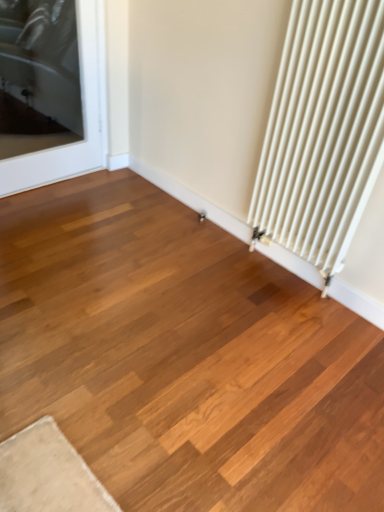
This screenshot has width=384, height=512. What do you see at coordinates (83, 118) in the screenshot? I see `transparent glass door at upper left` at bounding box center [83, 118].

Identify the location of transparent glass door at upper left. (83, 118).

What is the approximate height of transparent glass door at upper left?

38.09 inches.

The height and width of the screenshot is (512, 384). I want to click on white matte radiator at right, so click(322, 128).

What do you see at coordinates (322, 128) in the screenshot?
I see `white matte radiator at right` at bounding box center [322, 128].

Where is `transparent glass door at upper left`? This screenshot has width=384, height=512. transparent glass door at upper left is located at coordinates (83, 118).

Is transparent glass door at upper left to the left or to the right of white matte radiator at right in the image?

transparent glass door at upper left is to the left of white matte radiator at right.

Does transparent glass door at upper left come in front of white matte radiator at right?

No, the depth of transparent glass door at upper left is greater than that of white matte radiator at right.

Does point (83, 5) lie in front of point (255, 189)?

That is False.

From the image's perspective, is transparent glass door at upper left above or below white matte radiator at right?

transparent glass door at upper left is above white matte radiator at right.

From a real-world perspective, is transparent glass door at upper left positioned over white matte radiator at right based on gravity?

No, from a real-world perspective, transparent glass door at upper left is not over white matte radiator at right

Considering the sizes of objects transparent glass door at upper left and white matte radiator at right in the image provided, who is thinner, transparent glass door at upper left or white matte radiator at right?

transparent glass door at upper left is thinner.

In terms of height, does transparent glass door at upper left look taller or shorter compared to white matte radiator at right?

In the image, transparent glass door at upper left appears to be shorter than white matte radiator at right.

Which of these two, transparent glass door at upper left or white matte radiator at right, is bigger?

white matte radiator at right is bigger.

Does transparent glass door at upper left contain white matte radiator at right?

No, white matte radiator at right is not inside transparent glass door at upper left.

Is transparent glass door at upper left positioned far away from white matte radiator at right?

Yes, transparent glass door at upper left is far from white matte radiator at right.

Is transparent glass door at upper left oriented towards white matte radiator at right?

Yes, transparent glass door at upper left is facing white matte radiator at right.

The image size is (384, 512). I want to click on radiator below the transparent glass door at upper left (from the image's perspective), so click(x=322, y=128).

Is white matte radiator at right at the left side of transparent glass door at upper left?

No, white matte radiator at right is not to the left of transparent glass door at upper left.

Is the depth of white matte radiator at right greater than that of transparent glass door at upper left?

No.

Considering the positions of points (363, 42) and (82, 85), is point (363, 42) closer to camera compared to point (82, 85)?

Yes, it is.

From the image's perspective, is white matte radiator at right above or below transparent glass door at upper left?

From the image's perspective, white matte radiator at right appears below transparent glass door at upper left.

From a real-world perspective, is white matte radiator at right located higher than transparent glass door at upper left?

Yes.

Is white matte radiator at right wider or thinner than transparent glass door at upper left?

Clearly, white matte radiator at right has more width compared to transparent glass door at upper left.

Considering the sizes of white matte radiator at right and transparent glass door at upper left in the image, is white matte radiator at right taller or shorter than transparent glass door at upper left?

In the image, white matte radiator at right appears to be taller than transparent glass door at upper left.

Looking at this image, does white matte radiator at right have a smaller size compared to transparent glass door at upper left?

Actually, white matte radiator at right might be larger than transparent glass door at upper left.

Is white matte radiator at right completely or partially outside of transparent glass door at upper left?

Yes, white matte radiator at right is outside of transparent glass door at upper left.

Would you consider white matte radiator at right to be distant from transparent glass door at upper left?

Yes.

Is white matte radiator at right oriented towards transparent glass door at upper left?

No, white matte radiator at right is not turned towards transparent glass door at upper left.

What's the angular difference between white matte radiator at right and transparent glass door at upper left's facing directions?

They differ by 88.5 degrees in their facing directions.

How far apart are white matte radiator at right and transparent glass door at upper left?

white matte radiator at right is 4.42 feet from transparent glass door at upper left.

Where is `radiator above the transparent glass door at upper left (from a real-world perspective)`? The width and height of the screenshot is (384, 512). radiator above the transparent glass door at upper left (from a real-world perspective) is located at coordinates (322, 128).

This screenshot has width=384, height=512. There is a transparent glass door at upper left. In order to click on radiator above it (from a real-world perspective) in this screenshot , I will do `click(322, 128)`.

The image size is (384, 512). In order to click on radiator on the right of the transparent glass door at upper left in this screenshot , I will do `click(322, 128)`.